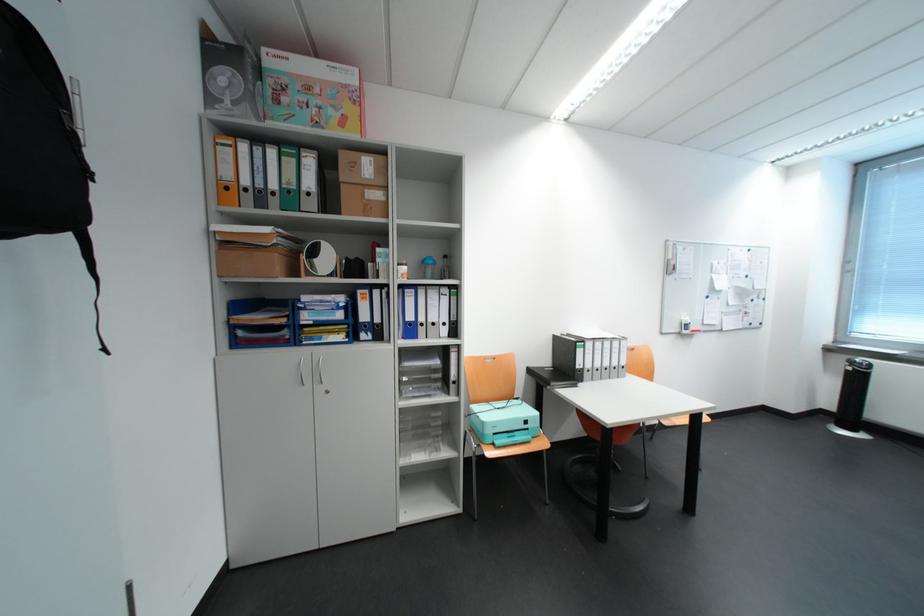
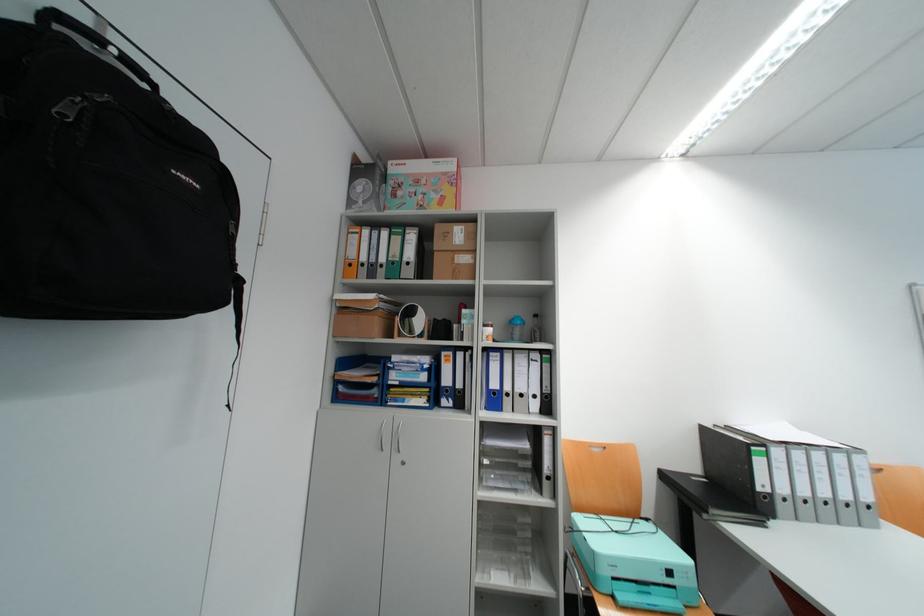
In the second image, find the point that corresponds to (505,426) in the first image.

(624, 562)